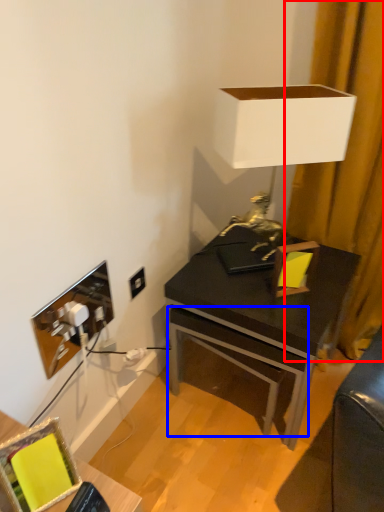
Question: Which object appears closest to the camera in this image, curtain (highlighted by a red box) or drawer (highlighted by a blue box)?

Choices:
 (A) curtain
 (B) drawer

Answer: (A)